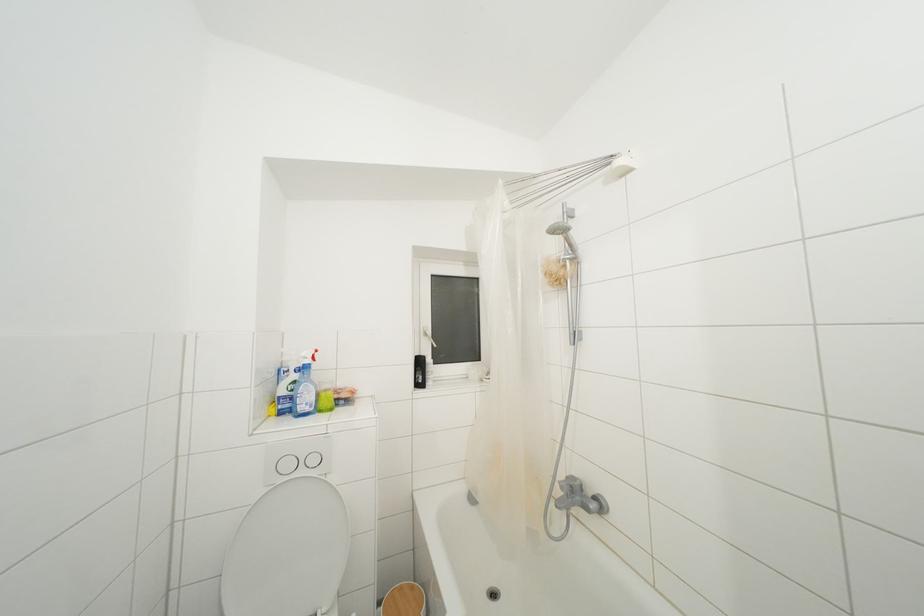
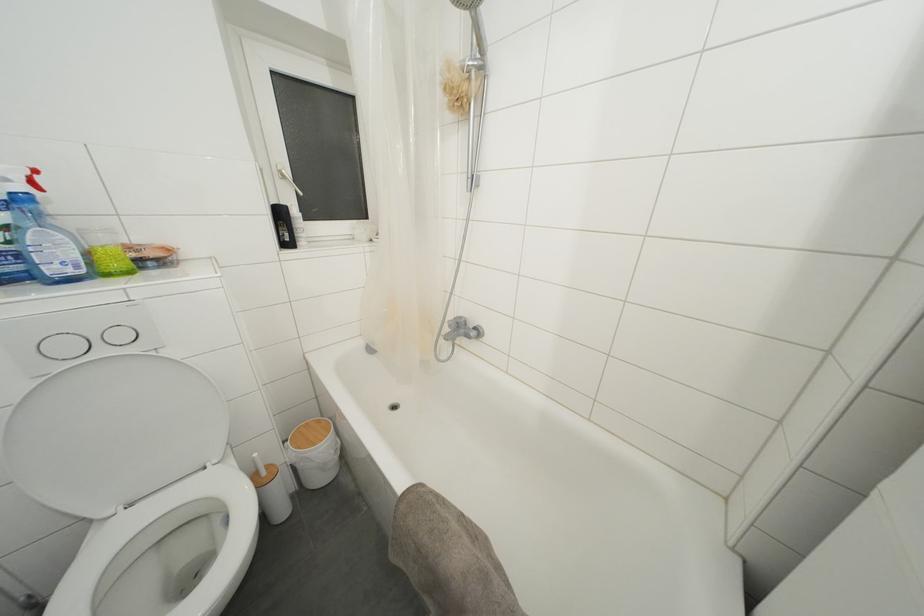
Locate, in the second image, the point that corresponds to (565,480) in the first image.

(455, 321)